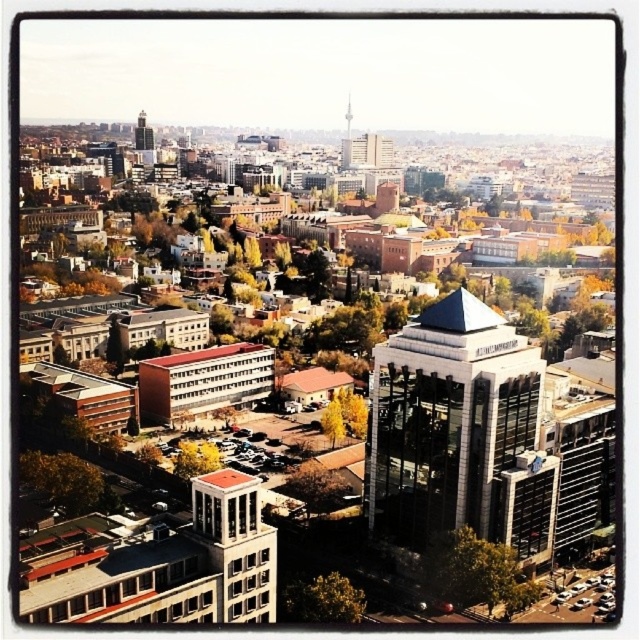
You are a drone operator trying to deliver a package to the glassy silver tower at center. Your current position is at coordinates 0.5, 0.5. Can you fly directly to the tower without any obstacles? Please explain your reasoning based on the scene description.

The glassy silver tower at center is located at point (x=458, y=433). Since your current position is at (x=320, y=320), you can fly directly towards the tower as there are no obstacles mentioned in the scene description between these coordinates. The aerial view shows a clear path through the cityscape.

You are a drone operator trying to navigate a delivery drone to a specific location in the city. The drone is currently above the tall, glass fronted building with a white facade and pointed roof. You need to drop a package at the green leafy tree at center. Based on the city layout, can you determine the approximate direction the drone should fly from the building to reach the tree?

The green leafy tree at center is located at coordinates approximately 0.762 on the x axis and 0.498 on the y axis. Since the drone is above the tall glass fronted building with a white facade and pointed roof, which is likely positioned in the foreground cluster of buildings, the drone should fly towards the center of the image to reach the tree.